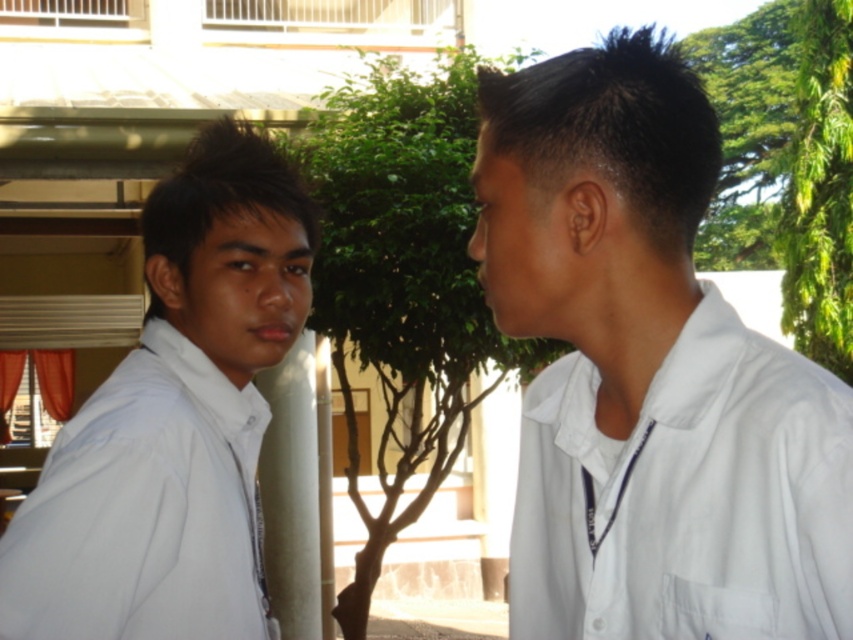
Is white matte shirt at center further to camera compared to white matte shirt at left?

No, it is in front of white matte shirt at left.

I want to click on white matte shirt at center, so click(x=648, y=372).